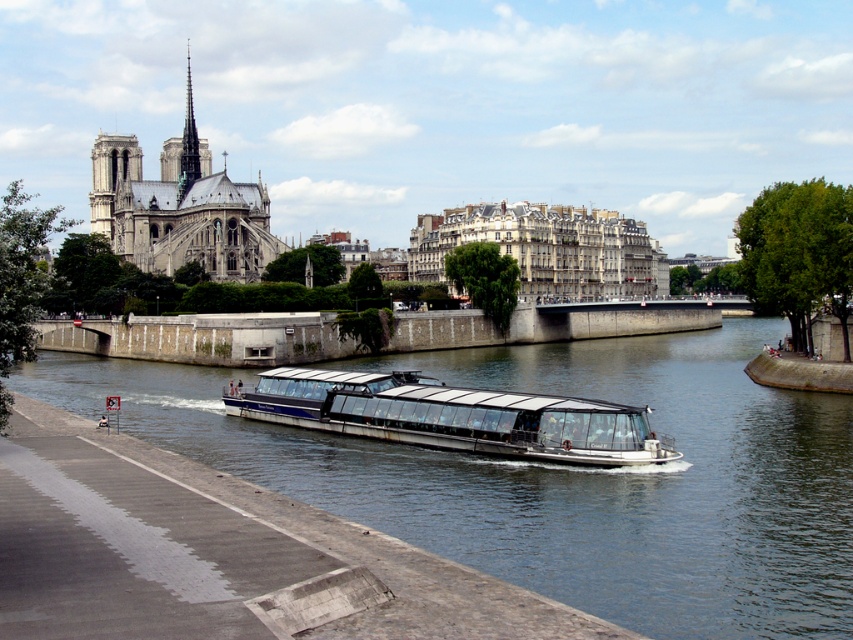
Does clear water at center have a greater height compared to stone gothic cathedral at upper left?

In fact, clear water at center may be shorter than stone gothic cathedral at upper left.

Based on the photo, is clear water at center below stone gothic cathedral at upper left?

Correct, clear water at center is located below stone gothic cathedral at upper left.

Is point (380, 506) closer to camera compared to point (218, 204)?

That is True.

Identify the location of clear water at center. (561, 477).

Looking at this image, which is below, white matte glass boat at center or stone gothic cathedral at upper left?

white matte glass boat at center is below.

Can you confirm if white matte glass boat at center is positioned above stone gothic cathedral at upper left?

Actually, white matte glass boat at center is below stone gothic cathedral at upper left.

Describe the element at coordinates (453, 417) in the screenshot. I see `white matte glass boat at center` at that location.

You are a GUI agent. You are given a task and a screenshot of the screen. Output one action in this format:
    pyautogui.click(x=<x>, y=<y>)
    Task: Click on the white matte glass boat at center
    
    Given the screenshot: What is the action you would take?
    pyautogui.click(x=453, y=417)

Between clear water at center and white matte glass boat at center, which one appears on the left side from the viewer's perspective?

Positioned to the left is white matte glass boat at center.

Does clear water at center have a lesser width compared to white matte glass boat at center?

No, clear water at center is not thinner than white matte glass boat at center.

The image size is (853, 640). Identify the location of clear water at center. (561, 477).